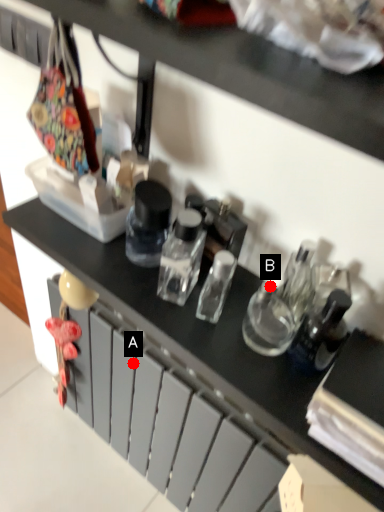
Question: Two points are circled on the image, labeled by A and B beside each circle. Which point appears farthest from the camera in this image?

Choices:
 (A) A is further
 (B) B is further

Answer: (A)